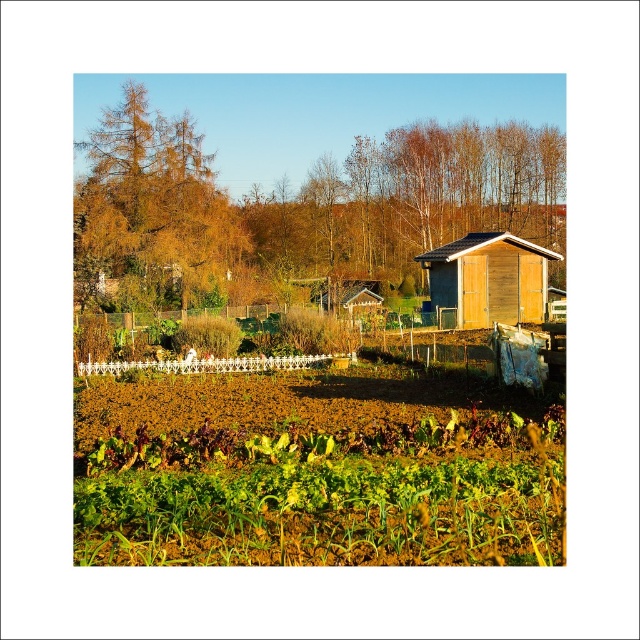
Which of these two, green leafy vegetables at lower center or wooden shed at center-right, stands shorter?

With less height is green leafy vegetables at lower center.

Does point (214, 412) come closer to viewer compared to point (536, 307)?

Yes, point (214, 412) is in front of point (536, 307).

Measure the distance between green leafy vegetables at lower center and camera.

green leafy vegetables at lower center is 5.13 meters away from camera.

Locate an element on the screen. green leafy vegetables at lower center is located at coordinates (307, 468).